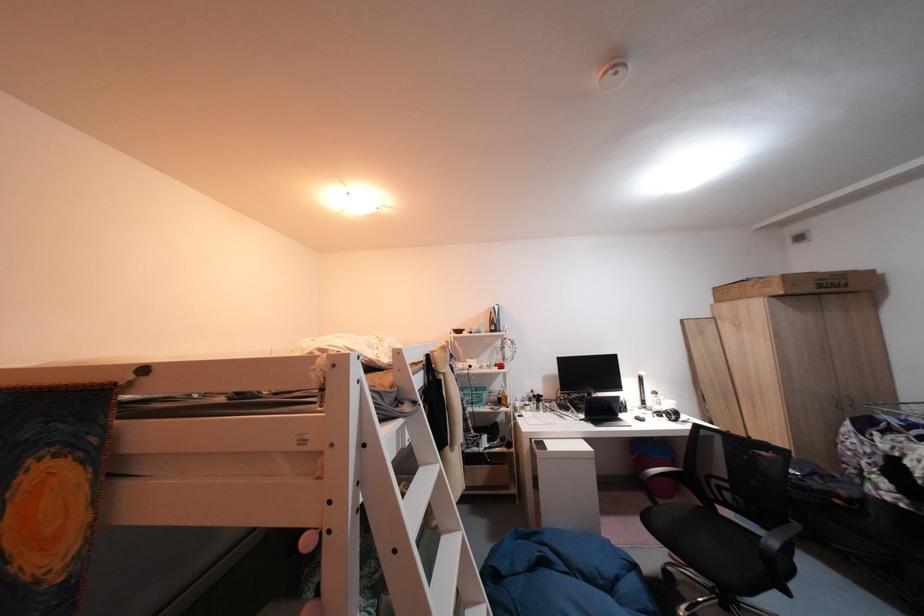
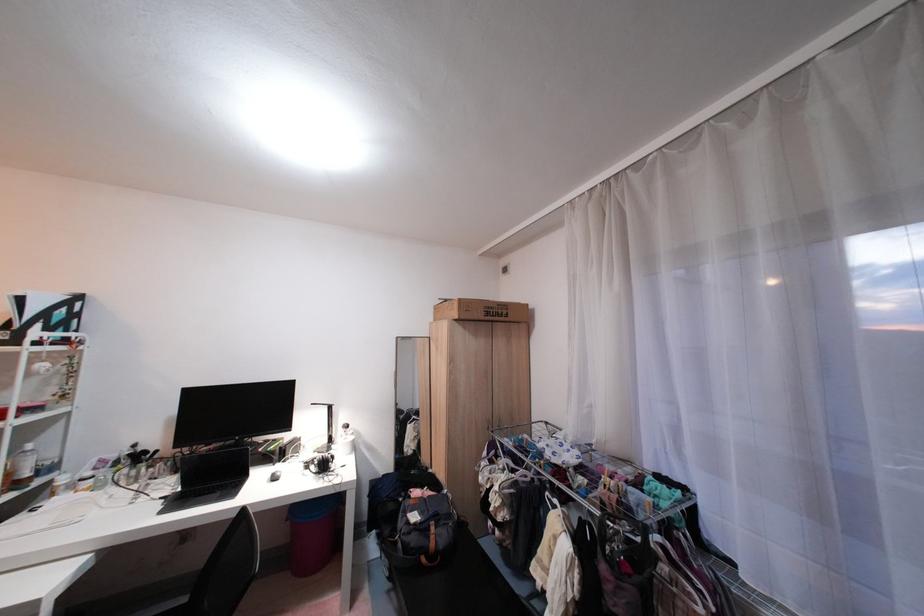
Locate, in the second image, the point that corresponds to [794,278] in the first image.

(470, 302)